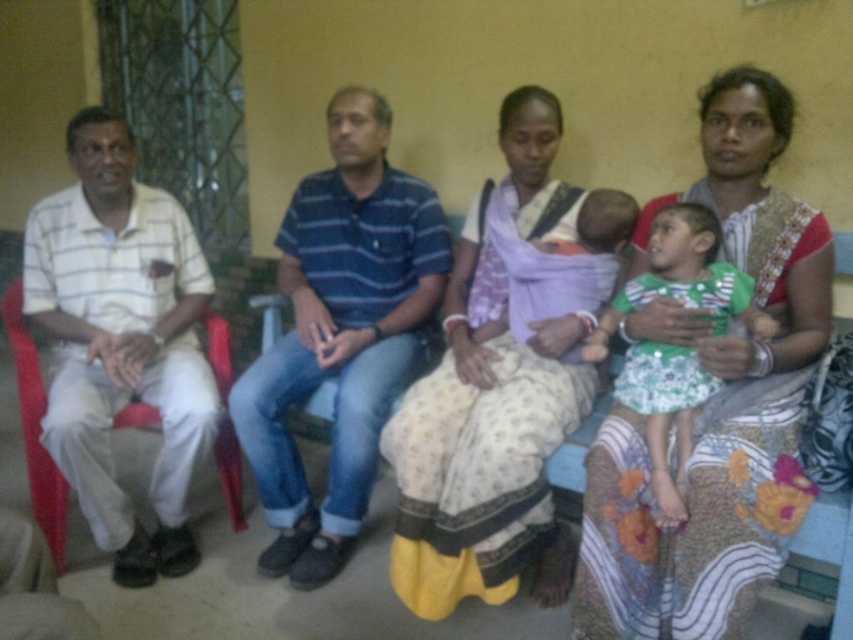
Question: Among these objects, which one is nearest to the camera?

Choices:
 (A) green striped shirt at center
 (B) light purple fabric baby carrier at center

Answer: (A)

Question: Is the position of printed cotton saree at right less distant than that of green striped shirt at center?

Choices:
 (A) yes
 (B) no

Answer: (A)

Question: Which of these objects is positioned farthest from the green striped shirt at center?

Choices:
 (A) light purple fabric baby carrier at center
 (B) blue striped shirt at center
 (C) white cotton shirt at left

Answer: (C)

Question: Which object is positioned farthest from the light purple fabric baby carrier at center?

Choices:
 (A) blue striped shirt at center
 (B) green striped shirt at center

Answer: (A)

Question: Considering the relative positions of light purple fabric baby carrier at center and green striped shirt at center in the image provided, where is light purple fabric baby carrier at center located with respect to green striped shirt at center?

Choices:
 (A) right
 (B) left

Answer: (B)

Question: Is printed cotton saree at right to the left of blue striped shirt at center from the viewer's perspective?

Choices:
 (A) yes
 (B) no

Answer: (B)